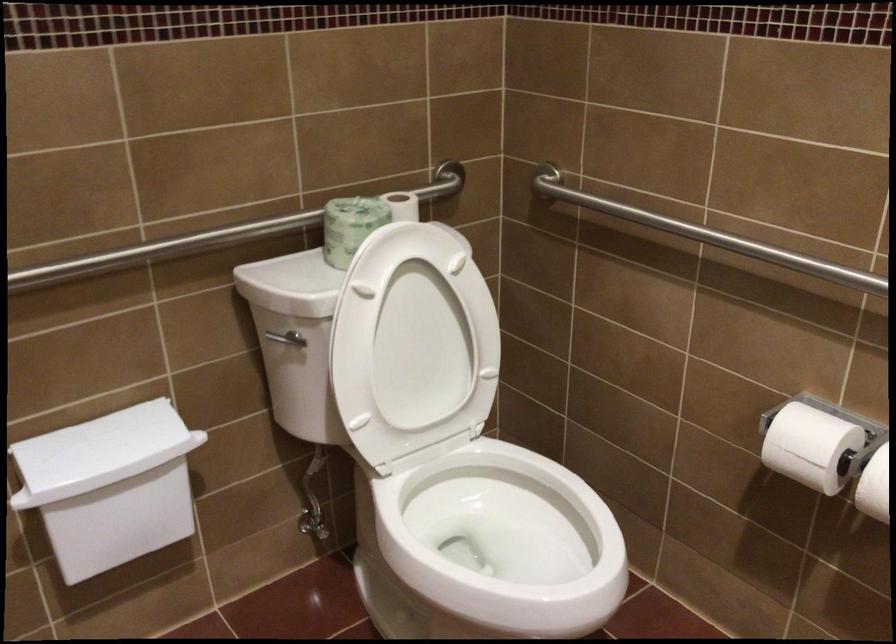
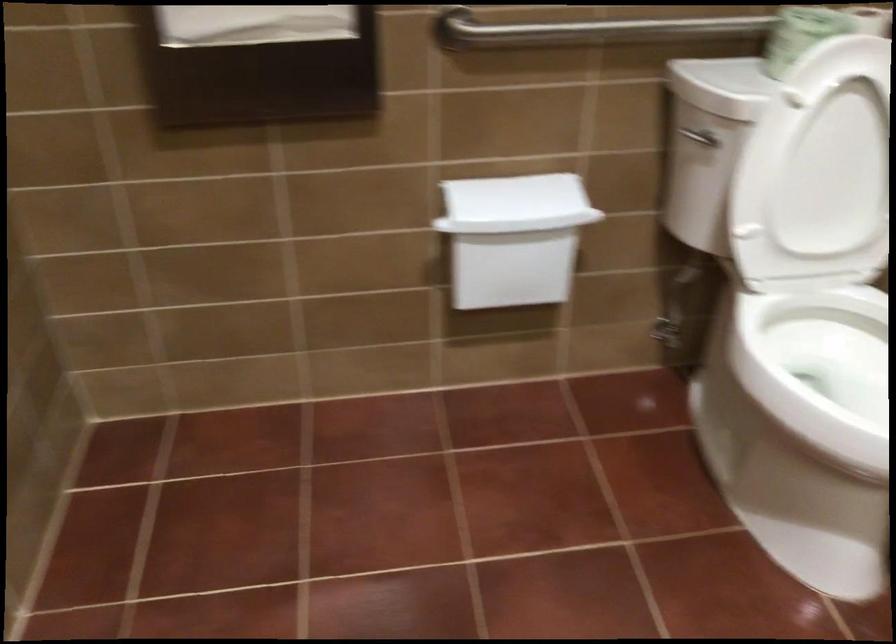
Locate, in the second image, the point that corresponds to [134,263] in the first image.

(586, 31)